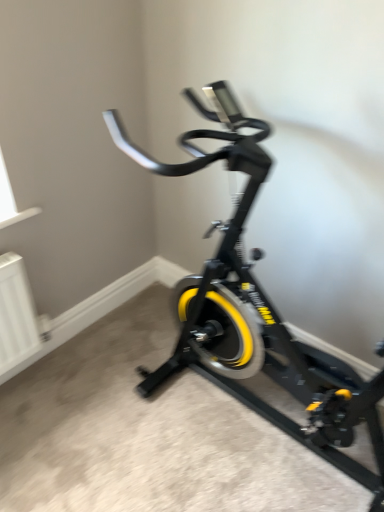
Find the location of a particular element. free space that is to the left of yellow matte stationary bicycle at center is located at coordinates (105, 413).